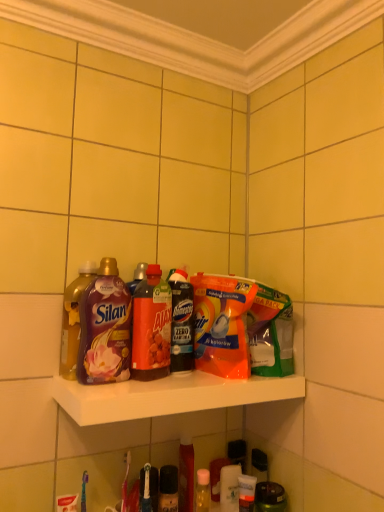
Find the location of a particular element. The image size is (384, 512). vacant area that is in front of translucent plastic bottle at center, which is the first bottle in right-to-left order is located at coordinates (170, 382).